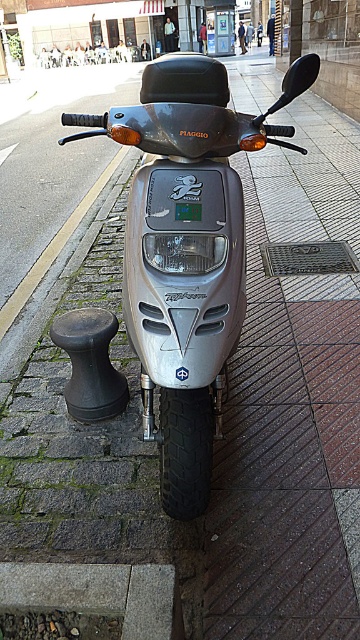
You need to place a rectangular box that is 15 cm wide between the gray concrete curb at lower left and the green plastic license plate at center. Based on their widths, will the box fit without overlapping either object?

The gray concrete curb at lower left is wider than the green plastic license plate at center. Since the box is 15 cm wide, but we don not know the exact widths of the curb or the license plate, it is impossible to determine if the box will fit without overlapping either object.

You are standing at the point where the gray cobblestones meet the reddish tiles. You want to walk towards the Piaggio Fly scooter. Which direction should you head to avoid stepping on the gray concrete curb represented by point (95,593)?

To avoid stepping on the gray concrete curb represented by point (95,593), you should walk towards the Piaggio Fly scooter while staying on the reddish tiles since the curb is located at the lower left point (95,593), which is away from the scooter parking area.

You are a delivery person who needs to park your scooter. The gray concrete curb at lower left and the green plastic license plate at center are both visible. Which object is closer to you when you look at the scene?

The gray concrete curb at lower left is closer to the viewer than the green plastic license plate at center.